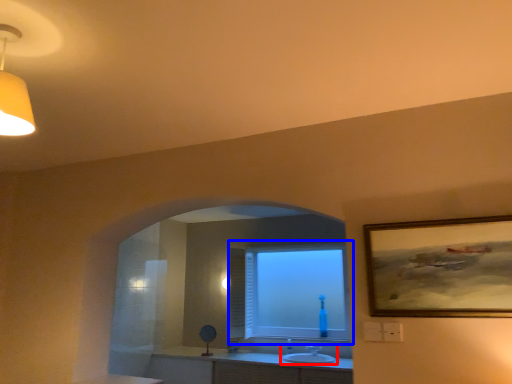
Question: Which point is further to the camera, sink (highlighted by a red box) or window (highlighted by a blue box)?

Choices:
 (A) sink
 (B) window

Answer: (B)